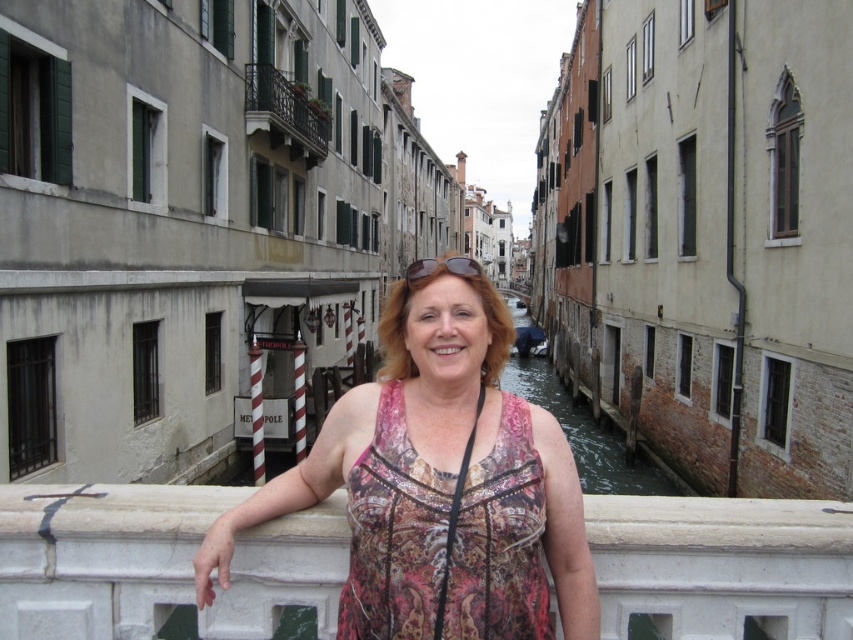
You are a tourist in Venice and want to take a photo of the greenish concrete canal at center. Based on your position on the bridge, can you see the canal clearly?

Yes, the greenish concrete canal at center is located at point (590, 433), so it should be visible from your position on the bridge.